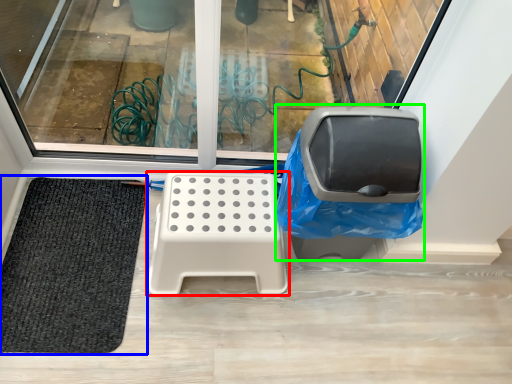
Question: Based on their relative distances, which object is nearer to furniture (highlighted by a red box)? Choose from mat (highlighted by a blue box) and swivel chair (highlighted by a green box).

Choices:
 (A) mat
 (B) swivel chair

Answer: (B)